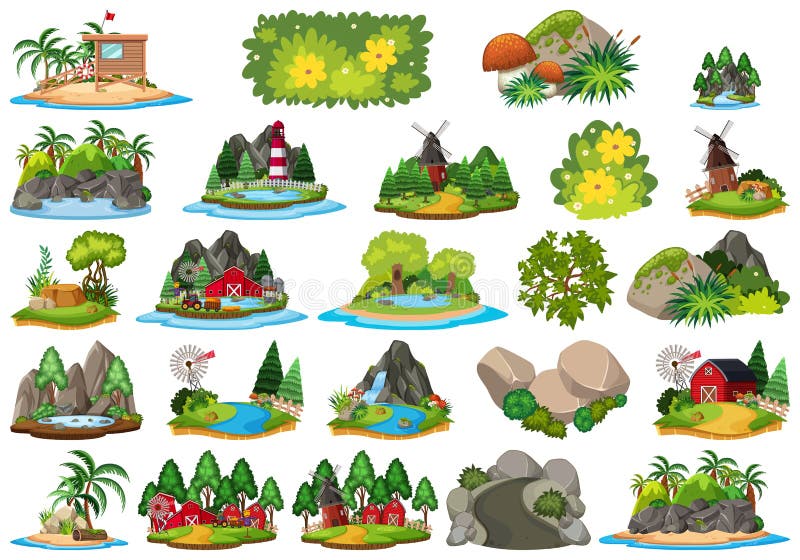
You are a GUI agent. You are given a task and a screenshot of the screen. Output one action in this format:
    pyautogui.click(x=<x>, y=<y>)
    Task: Click on the palm tree pictures
    Image resolution: width=800 pixels, height=560 pixels.
    Given the screenshot: What is the action you would take?
    pyautogui.click(x=112, y=78), pyautogui.click(x=72, y=154), pyautogui.click(x=96, y=479), pyautogui.click(x=696, y=494)